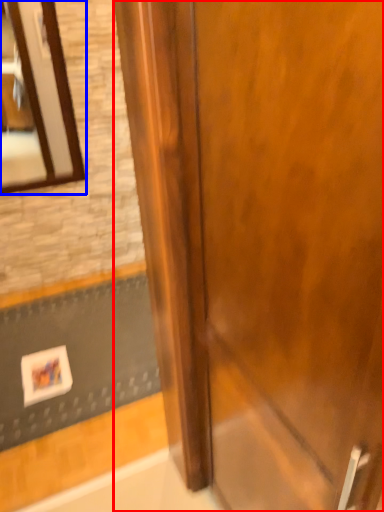
Question: Which object is further to the camera taking this photo, door (highlighted by a red box) or mirror (highlighted by a blue box)?

Choices:
 (A) door
 (B) mirror

Answer: (B)